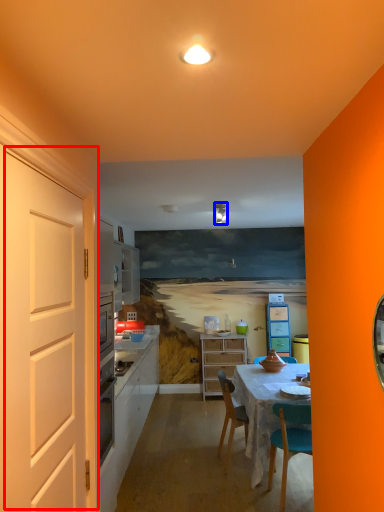
Question: Which of the following is the closest to the observer, door (highlighted by a red box) or light fixture (highlighted by a blue box)?

Choices:
 (A) door
 (B) light fixture

Answer: (A)